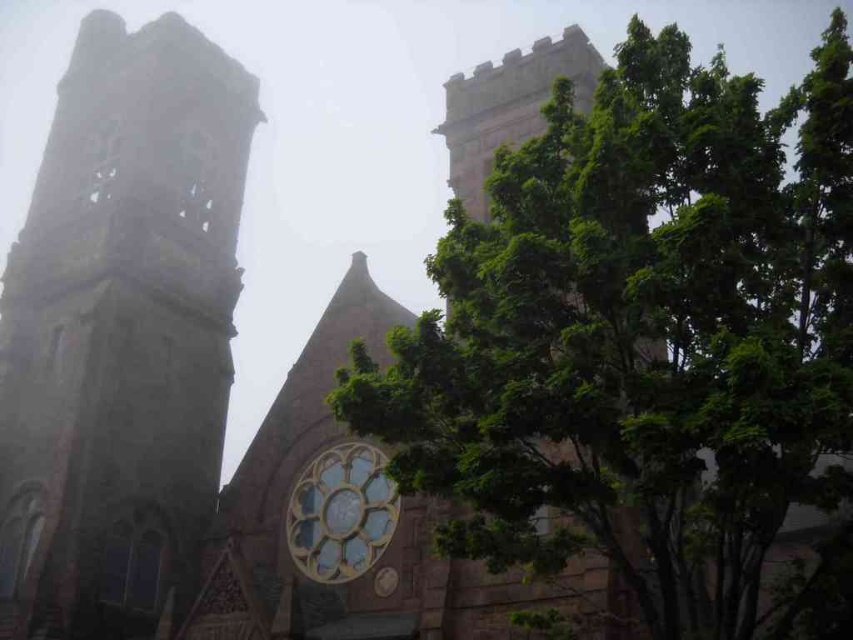
You are standing in front of the Gothic church and notice a green leafy tree in the scene. Based on its coordinates, where exactly is the green leafy tree at upper center located?

The green leafy tree at upper center is located at coordinates point (643, 342).

You are an architect examining the Gothic church. You notice the stone tower at left and the golden stained glass clock at center. Which object is positioned higher in the image?

The stone tower at left is located above the golden stained glass clock at center, so it is positioned higher in the image.

You are a bird flying over the Gothic church and want to land on a higher object. Between the green leafy tree at upper center and the golden stained glass clock at center, which one should you choose?

The green leafy tree at upper center is taller than the golden stained glass clock at center, so you should choose the green leafy tree at upper center to land on since it is higher.